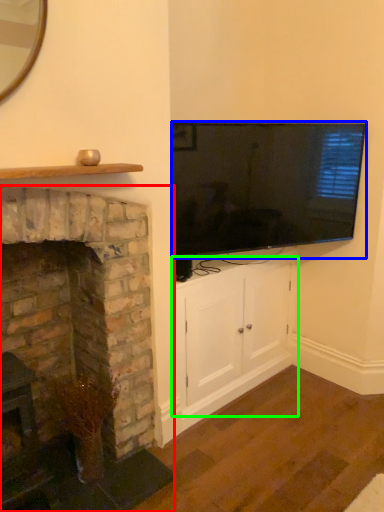
Question: Based on their relative distances, which object is farther from fireplace (highlighted by a red box)? Choose from television (highlighted by a blue box) and cabinetry (highlighted by a green box).

Choices:
 (A) television
 (B) cabinetry

Answer: (A)